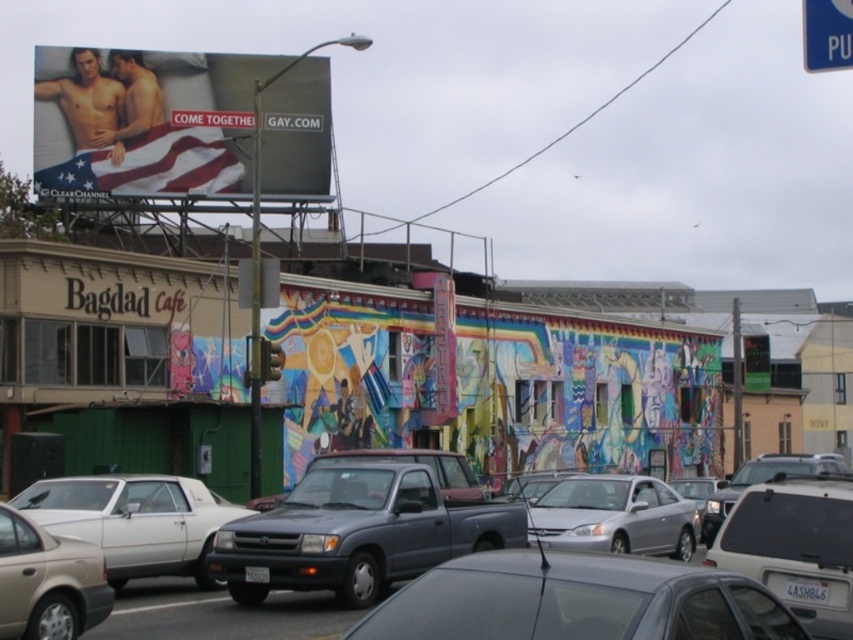
This screenshot has height=640, width=853. What do you see at coordinates (144, 122) in the screenshot?
I see `american flag fabric bed at upper left` at bounding box center [144, 122].

Does american flag fabric bed at upper left have a larger size compared to silver metallic truck at center?

Indeed, american flag fabric bed at upper left has a larger size compared to silver metallic truck at center.

Find the location of a particular element. The image size is (853, 640). american flag fabric bed at upper left is located at coordinates (144, 122).

This screenshot has height=640, width=853. I want to click on american flag fabric bed at upper left, so click(x=144, y=122).

Does metallic gray sedan at center appear on the left side of white plastic sign at upper right?

Yes, metallic gray sedan at center is to the left of white plastic sign at upper right.

Can you confirm if metallic gray sedan at center is taller than white plastic sign at upper right?

Incorrect, metallic gray sedan at center's height is not larger of white plastic sign at upper right's.

Locate an element on the screen. Image resolution: width=853 pixels, height=640 pixels. metallic gray sedan at center is located at coordinates (577, 600).

Does point (190, 568) lie in front of point (822, 29)?

No, it is behind (822, 29).

Does point (120, 500) come closer to viewer compared to point (810, 0)?

No, (120, 500) is behind (810, 0).

I want to click on white glossy sedan at lower left, so click(x=134, y=522).